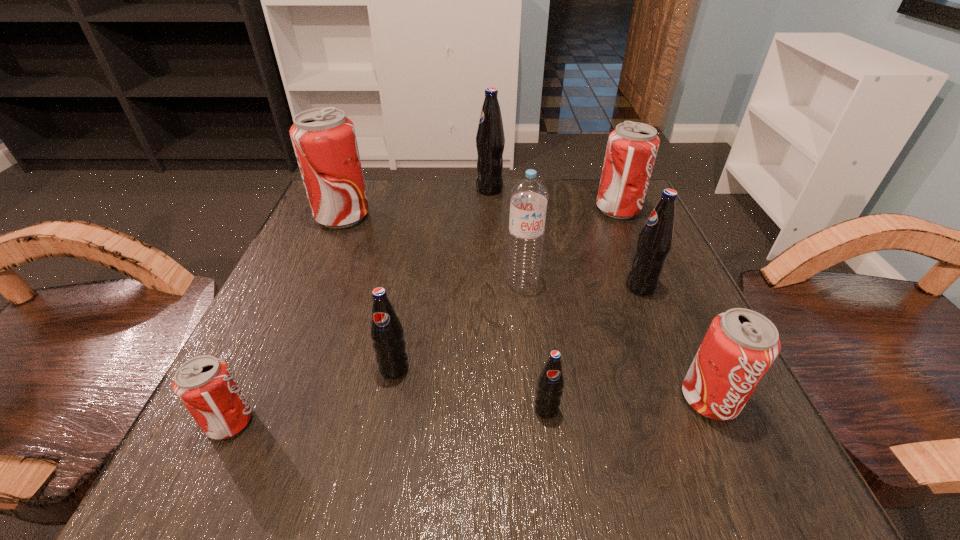
Where is `vacant region between the third biggest pink soda can and the biggest pink soda can`? vacant region between the third biggest pink soda can and the biggest pink soda can is located at coordinates (526, 307).

At what (x,y) coordinates should I click in order to perform the action: click on vacant region between the rightmost black pop and the second black pop from right to left. Please return your answer as a coordinate pair (x, y). The width and height of the screenshot is (960, 540). Looking at the image, I should click on (593, 348).

Identify the location of free space between the fourth pop from left to right and the biggest pink soda can. This screenshot has height=540, width=960. (416, 202).

Find the location of a particular element. empty location between the second farthest black pop and the water bottle is located at coordinates (582, 284).

The image size is (960, 540). Find the location of `free space between the fourth pop from left to right and the sixth pop from right to left`. free space between the fourth pop from left to right and the sixth pop from right to left is located at coordinates (442, 279).

Identify which object is the sixth nearest to the smallest pink soda can. Please provide its 2D coordinates. Your answer should be formatted as a tuple, i.e. [(x, y)], where the tuple contains the x and y coordinates of a point satisfying the conditions above.

[(654, 243)]

Locate which object is the fourth closest to the farthest black pop. Please provide its 2D coordinates. Your answer should be formatted as a tuple, i.e. [(x, y)], where the tuple contains the x and y coordinates of a point satisfying the conditions above.

[(654, 243)]

Identify which pop is located as the seventh nearest to the biggest pink soda can. Please provide its 2D coordinates. Your answer should be formatted as a tuple, i.e. [(x, y)], where the tuple contains the x and y coordinates of a point satisfying the conditions above.

[(740, 346)]

Identify the location of pop that stands as the second closest to the fourth pop from right to left. This screenshot has width=960, height=540. (386, 331).

Identify which black pop is located as the nearest to the smallest black pop. Please provide its 2D coordinates. Your answer should be formatted as a tuple, i.e. [(x, y)], where the tuple contains the x and y coordinates of a point satisfying the conditions above.

[(386, 331)]